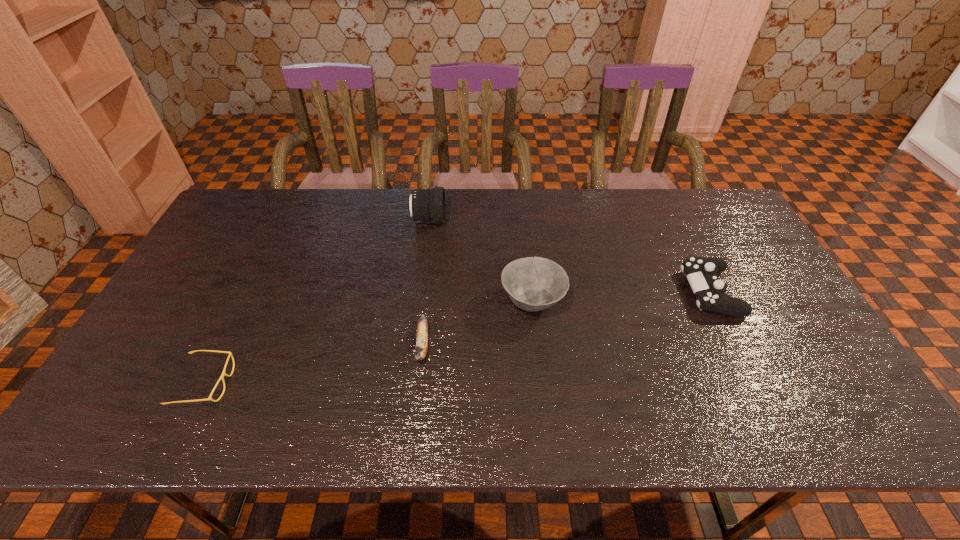
The height and width of the screenshot is (540, 960). I want to click on vacant area situated at the stem of the banana, so click(417, 400).

You are a GUI agent. You are given a task and a screenshot of the screen. Output one action in this format:
    pyautogui.click(x=<x>, y=<y>)
    Task: Click on the vacant region located on the surface of the rightmost object
    The height and width of the screenshot is (540, 960).
    Given the screenshot: What is the action you would take?
    pyautogui.click(x=597, y=292)

You are a GUI agent. You are given a task and a screenshot of the screen. Output one action in this format:
    pyautogui.click(x=<x>, y=<y>)
    Task: Click on the vacant space located on the surface of the rightmost object
    The width and height of the screenshot is (960, 540).
    Given the screenshot: What is the action you would take?
    pyautogui.click(x=604, y=292)

Locate an element on the screen. This screenshot has width=960, height=540. free space located 0.150m on the surface of the rightmost object is located at coordinates (633, 292).

Where is `vacant space situated in front of the lenses of the leftmost object`? The image size is (960, 540). vacant space situated in front of the lenses of the leftmost object is located at coordinates (374, 383).

Where is `object that is at the far edge`? object that is at the far edge is located at coordinates (428, 205).

Find the location of a particular element. The height and width of the screenshot is (540, 960). object positioned at the near edge is located at coordinates pyautogui.click(x=230, y=354).

Find the location of a particular element. object that is at the left edge is located at coordinates (230, 354).

Identify the location of object that is at the right edge. This screenshot has height=540, width=960. 701,272.

Image resolution: width=960 pixels, height=540 pixels. I want to click on object that is at the near left corner, so click(230, 354).